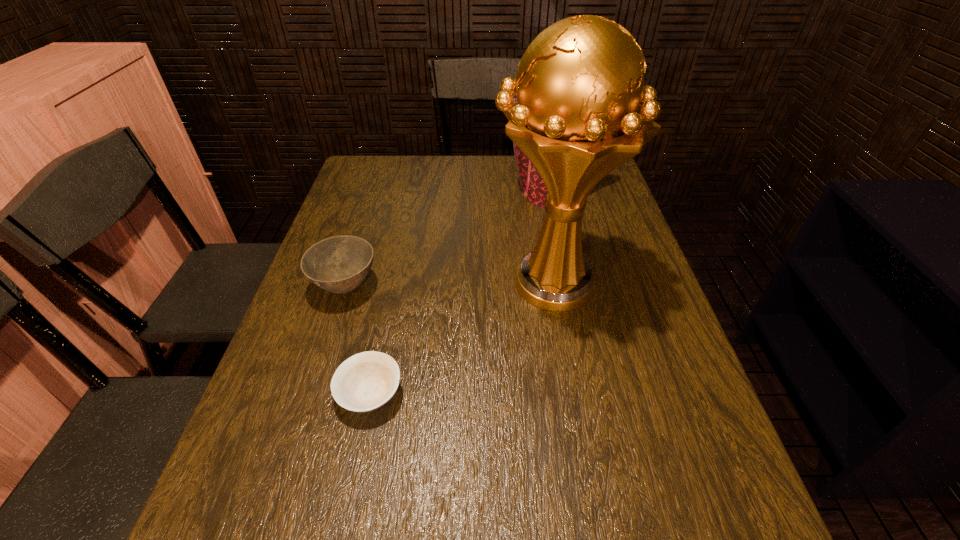
Image resolution: width=960 pixels, height=540 pixels. Identify the location of trophy_cup. 582,110.

Locate an element on the screen. The height and width of the screenshot is (540, 960). the farthest object is located at coordinates (533, 187).

I want to click on the second tallest object, so (x=533, y=187).

Locate an element on the screen. The image size is (960, 540). the farther bowl is located at coordinates (339, 264).

The image size is (960, 540). I want to click on the taller bowl, so click(x=339, y=264).

Find the location of a particular element. The height and width of the screenshot is (540, 960). the nearer bowl is located at coordinates (366, 381).

The width and height of the screenshot is (960, 540). Identify the location of the shorter bowl. 366,381.

What are the coordinates of `free space located at the front of the trophy_cup where the globe is prominent` in the screenshot? It's located at (394, 283).

Image resolution: width=960 pixels, height=540 pixels. Identify the location of vacant space located at the front of the trophy_cup where the globe is prominent. (369, 283).

I want to click on blank area located 0.320m at the front of the trophy_cup where the globe is prominent, so click(361, 283).